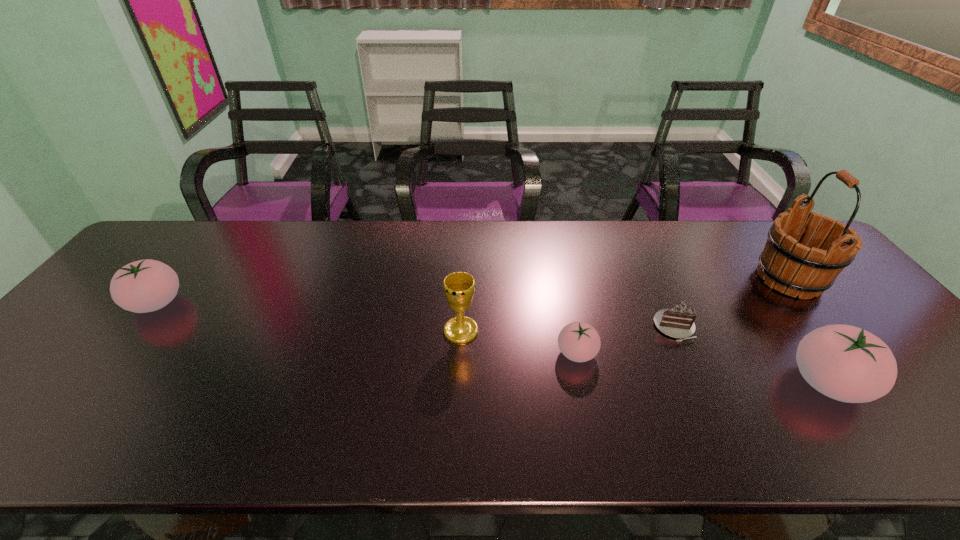
To achieve uniform spacing by inserting another tomato among them, please point to a free space for this new tomato. Please provide its 2D coordinates. Your answer should be formatted as a tuple, i.e. [(x, y)], where the tuple contains the x and y coordinates of a point satisfying the conditions above.

[(354, 327)]